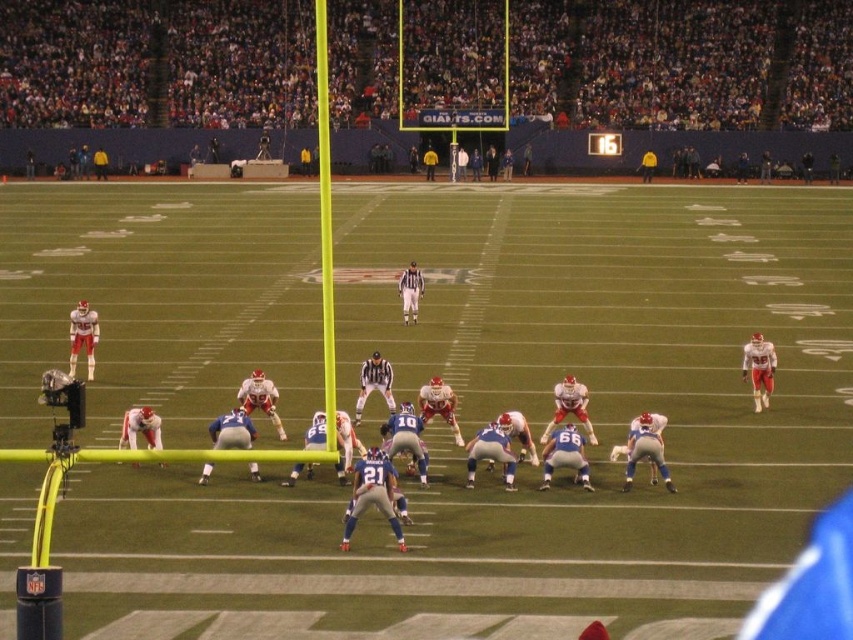
Question: Which point is closer to the camera?

Choices:
 (A) matte white helmet at right
 (B) white striped referee at center

Answer: (A)

Question: Is matte white helmet at right smaller than white striped referee at center?

Choices:
 (A) no
 (B) yes

Answer: (A)

Question: Which of the following is the farthest from the observer?

Choices:
 (A) (403, 310)
 (B) (769, 346)

Answer: (A)

Question: Does matte white helmet at right have a lesser width compared to white striped referee at center?

Choices:
 (A) no
 (B) yes

Answer: (A)

Question: Which of the following is the farthest from the observer?

Choices:
 (A) (741, 362)
 (B) (419, 296)

Answer: (B)

Question: Does matte white helmet at right appear on the left side of white striped referee at center?

Choices:
 (A) yes
 (B) no

Answer: (B)